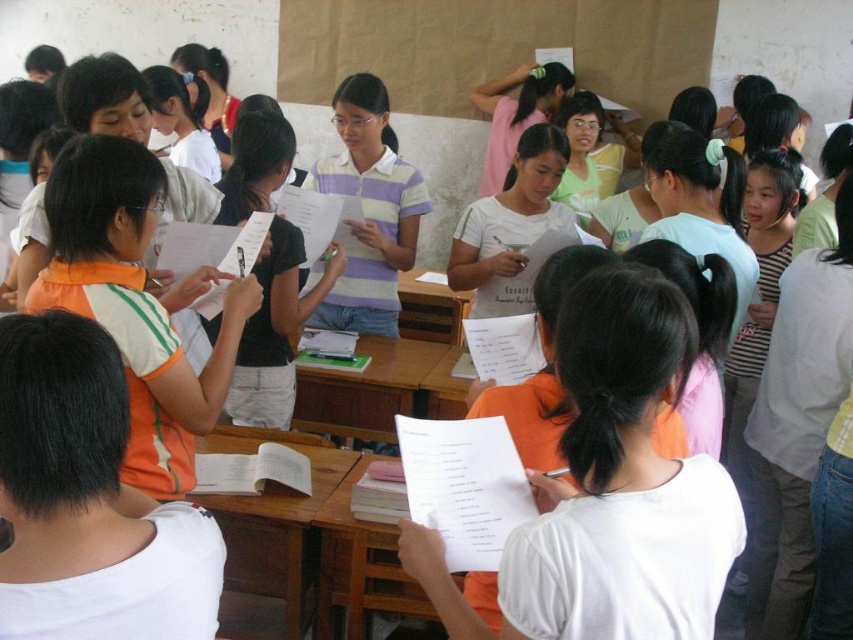
Question: Is black matte shirt at center further to camera compared to striped cotton shirt at center?

Choices:
 (A) yes
 (B) no

Answer: (B)

Question: Which of the following is the farthest from the observer?

Choices:
 (A) black matte shirt at center
 (B) striped cotton shirt at center
 (C) orange striped shirt at left

Answer: (B)

Question: Does black matte shirt at center have a larger size compared to striped cotton shirt at center?

Choices:
 (A) no
 (B) yes

Answer: (A)

Question: Is black matte shirt at center thinner than striped cotton shirt at center?

Choices:
 (A) yes
 (B) no

Answer: (A)

Question: Which point is closer to the camera taking this photo?

Choices:
 (A) (378, 90)
 (B) (248, 364)
 (C) (141, 392)

Answer: (C)

Question: Which object is positioned farthest from the orange striped shirt at left?

Choices:
 (A) striped cotton shirt at center
 (B) black matte shirt at center

Answer: (A)